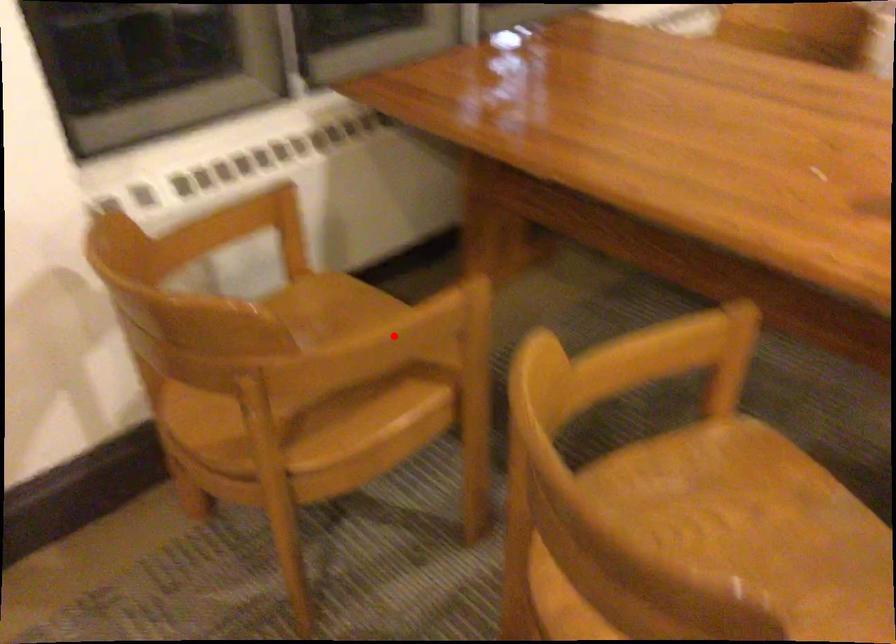
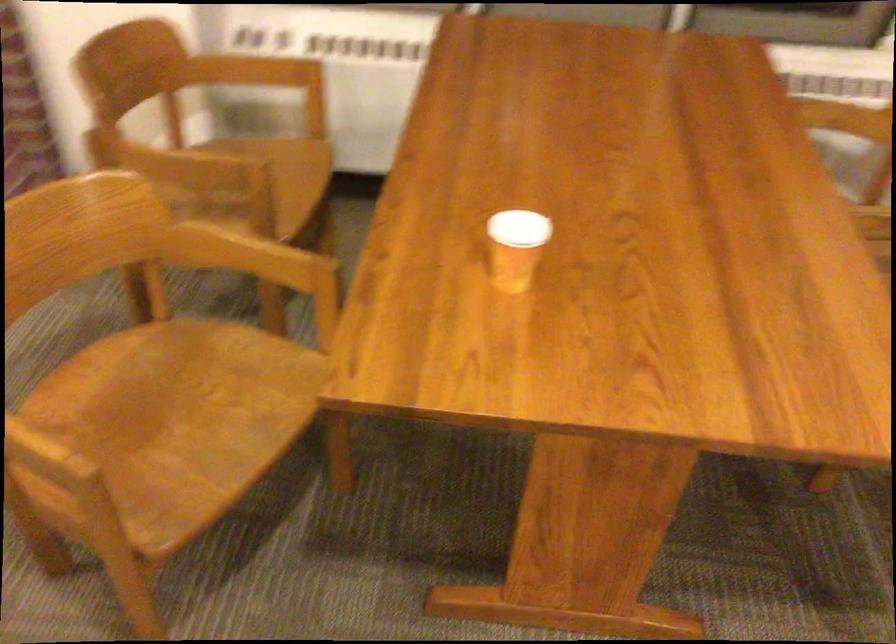
Question: I am providing you with two images of the same scene from different viewpoints. Image1 has a red point marked. In image2, the corresponding 3D location appears at what relative position? Reply with the corresponding letter.

Choices:
 (A) Closer
 (B) Farther

Answer: (B)